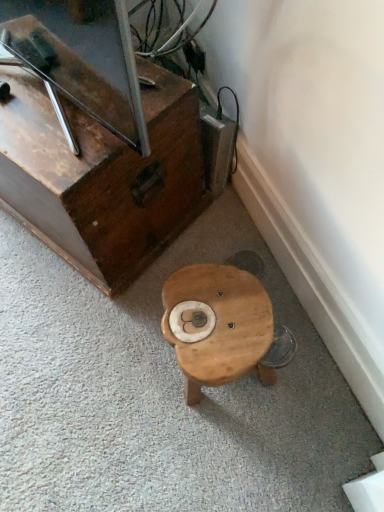
What do you see at coordinates (217, 325) in the screenshot? I see `wooden stool at center` at bounding box center [217, 325].

The height and width of the screenshot is (512, 384). Find the location of `wooden stool at center`. wooden stool at center is located at coordinates (217, 325).

What is the approximate width of wooden stool at center?

The width of wooden stool at center is 10.19 inches.

Measure the distance between point (x=70, y=56) and camera.

Point (x=70, y=56) and camera are 29.76 inches apart from each other.

This screenshot has height=512, width=384. What are the coordinates of `wooden chest at lower left` in the screenshot? It's located at (99, 164).

What do you see at coordinates (99, 164) in the screenshot? I see `wooden chest at lower left` at bounding box center [99, 164].

In order to click on wooden stool at center in this screenshot , I will do `click(217, 325)`.

Between wooden stool at center and wooden chest at lower left, which one appears on the left side from the viewer's perspective?

wooden chest at lower left.

Which object is closer to the camera, wooden stool at center or wooden chest at lower left?

wooden stool at center is more forward.

Is point (208, 289) farther from viewer compared to point (59, 47)?

Yes.

From the image's perspective, between wooden stool at center and wooden chest at lower left, which one is located above?

From the image's view, wooden chest at lower left is above.

From a real-world perspective, which is physically above, wooden stool at center or wooden chest at lower left?

From a 3D spatial view, wooden chest at lower left is above.

Which of these two, wooden stool at center or wooden chest at lower left, is thinner?

Thinner between the two is wooden stool at center.

Who is taller, wooden stool at center or wooden chest at lower left?

wooden chest at lower left.

Considering the relative sizes of wooden stool at center and wooden chest at lower left in the image provided, is wooden stool at center smaller than wooden chest at lower left?

Yes, wooden stool at center is smaller than wooden chest at lower left.

Is wooden stool at center outside of wooden chest at lower left?

wooden stool at center lies outside wooden chest at lower left's area.

Is wooden stool at center placed right next to wooden chest at lower left?

wooden stool at center and wooden chest at lower left are clearly separated.

Could you tell me if wooden stool at center is turned towards wooden chest at lower left?

No, wooden stool at center is not oriented towards wooden chest at lower left.

This screenshot has width=384, height=512. Identify the location of furniture located on the left of wooden stool at center. 99,164.

Which object is positioned more to the left, wooden chest at lower left or wooden stool at center?

Positioned to the left is wooden chest at lower left.

Which is behind, wooden chest at lower left or wooden stool at center?

wooden chest at lower left is further away from the camera.

Is point (8, 117) positioned before point (231, 328)?

No, (8, 117) is behind (231, 328).

From the image's perspective, is wooden chest at lower left on wooden stool at center?

Yes.

From a real-world perspective, which is physically below, wooden chest at lower left or wooden stool at center?

wooden stool at center is physically lower.

Looking at this image, considering the relative sizes of wooden chest at lower left and wooden stool at center in the image provided, is wooden chest at lower left thinner than wooden stool at center?

No, wooden chest at lower left is not thinner than wooden stool at center.

In terms of height, does wooden chest at lower left look taller or shorter compared to wooden stool at center?

Clearly, wooden chest at lower left is taller compared to wooden stool at center.

Does wooden chest at lower left have a smaller size compared to wooden stool at center?

Incorrect, wooden chest at lower left is not smaller in size than wooden stool at center.

Choose the correct answer: Is wooden chest at lower left inside wooden stool at center or outside it?

wooden chest at lower left is outside wooden stool at center.

Would you say wooden chest at lower left is a long distance from wooden stool at center?

No, there isn't a large distance between wooden chest at lower left and wooden stool at center.

Is wooden chest at lower left looking in the opposite direction of wooden stool at center?

wooden chest at lower left does not have its back to wooden stool at center.

How different are the orientations of wooden chest at lower left and wooden stool at center in degrees?

They differ by 32.8 degrees in their facing directions.

How much distance is there between wooden chest at lower left and wooden stool at center?

wooden chest at lower left is 13.61 inches from wooden stool at center.

This screenshot has width=384, height=512. In the image, there is a wooden chest at lower left. What are the coordinates of `table below it (from a real-world perspective)` in the screenshot? It's located at (217, 325).

I want to click on table that appears in front of the wooden chest at lower left, so click(217, 325).

Locate an element on the screen. The image size is (384, 512). furniture that appears on the left of wooden stool at center is located at coordinates (99, 164).